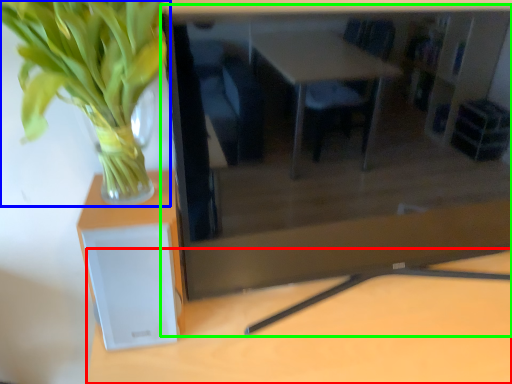
Question: Based on their relative distances, which object is farther from table (highlighted by a red box)? Choose from houseplant (highlighted by a blue box) and computer desk (highlighted by a green box).

Choices:
 (A) houseplant
 (B) computer desk

Answer: (A)